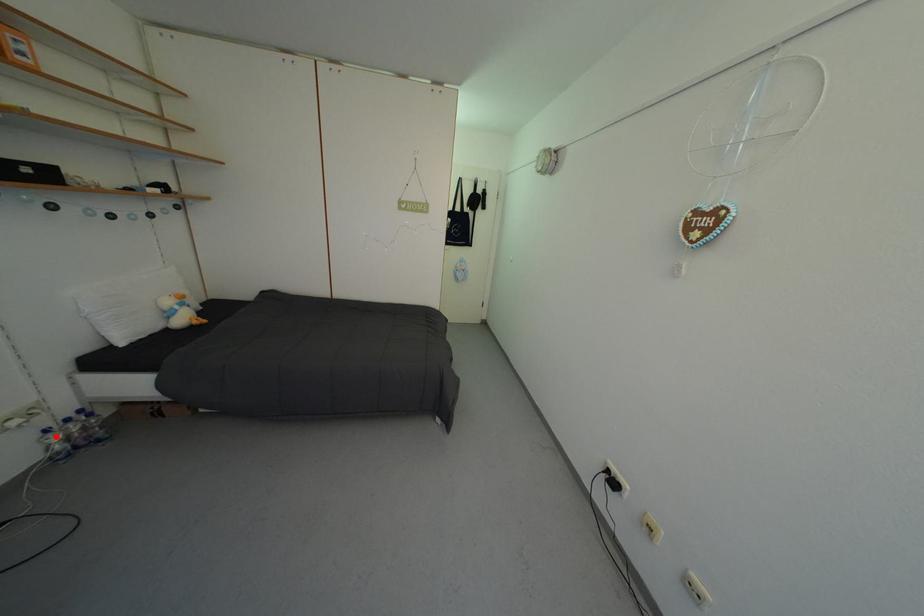
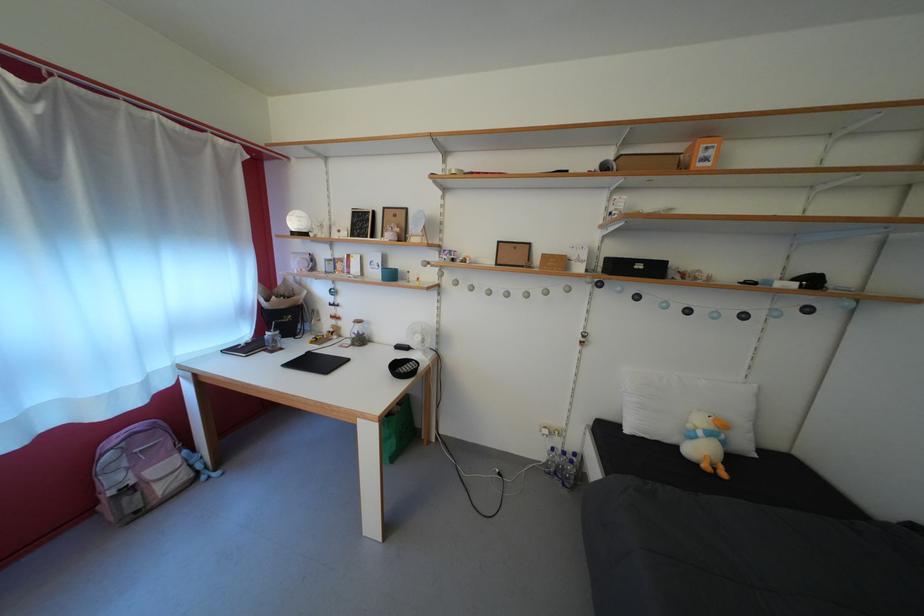
The point at the highlighted location is marked in the first image. Where is the corresponding point in the second image?

(562, 455)